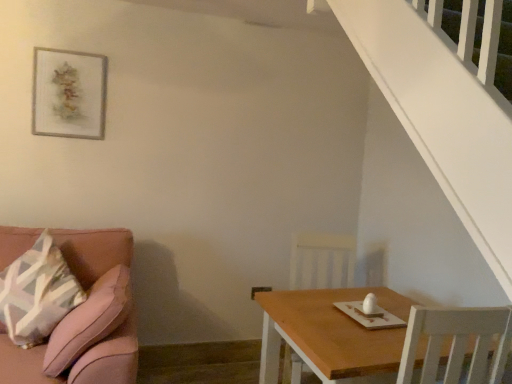
Question: Is wooden table at lower right far away from wooden chair at lower right?

Choices:
 (A) yes
 (B) no

Answer: (B)

Question: Does wooden table at lower right turn towards wooden chair at lower right?

Choices:
 (A) yes
 (B) no

Answer: (B)

Question: Is wooden table at lower right at the left side of wooden chair at lower right?

Choices:
 (A) no
 (B) yes

Answer: (A)

Question: From a real-world perspective, is wooden table at lower right physically below wooden chair at lower right?

Choices:
 (A) no
 (B) yes

Answer: (B)

Question: Does wooden table at lower right have a smaller size compared to wooden chair at lower right?

Choices:
 (A) yes
 (B) no

Answer: (B)

Question: From the image's perspective, is wooden picture frame at upper left positioned above or below pink fabric couch at left?

Choices:
 (A) above
 (B) below

Answer: (A)

Question: Relative to pink fabric couch at left, is wooden picture frame at upper left in front or behind?

Choices:
 (A) front
 (B) behind

Answer: (B)

Question: From a real-world perspective, is wooden picture frame at upper left physically located above or below pink fabric couch at left?

Choices:
 (A) below
 (B) above

Answer: (B)

Question: In terms of width, does wooden picture frame at upper left look wider or thinner when compared to pink fabric couch at left?

Choices:
 (A) wide
 (B) thin

Answer: (B)

Question: Is pink fabric couch at left in front of or behind wooden table at lower right in the image?

Choices:
 (A) behind
 (B) front

Answer: (A)

Question: Considering the positions of point (59, 367) and point (399, 345), is point (59, 367) closer or farther from the camera than point (399, 345)?

Choices:
 (A) closer
 (B) farther

Answer: (B)

Question: Based on their positions, is pink fabric couch at left located to the left or right of wooden table at lower right?

Choices:
 (A) left
 (B) right

Answer: (A)

Question: Is pink fabric couch at left inside the boundaries of wooden table at lower right, or outside?

Choices:
 (A) inside
 (B) outside

Answer: (B)

Question: From a real-world perspective, is wooden chair at lower right positioned above or below wooden picture frame at upper left?

Choices:
 (A) below
 (B) above

Answer: (A)

Question: Is wooden chair at lower right situated inside wooden picture frame at upper left or outside?

Choices:
 (A) outside
 (B) inside

Answer: (A)